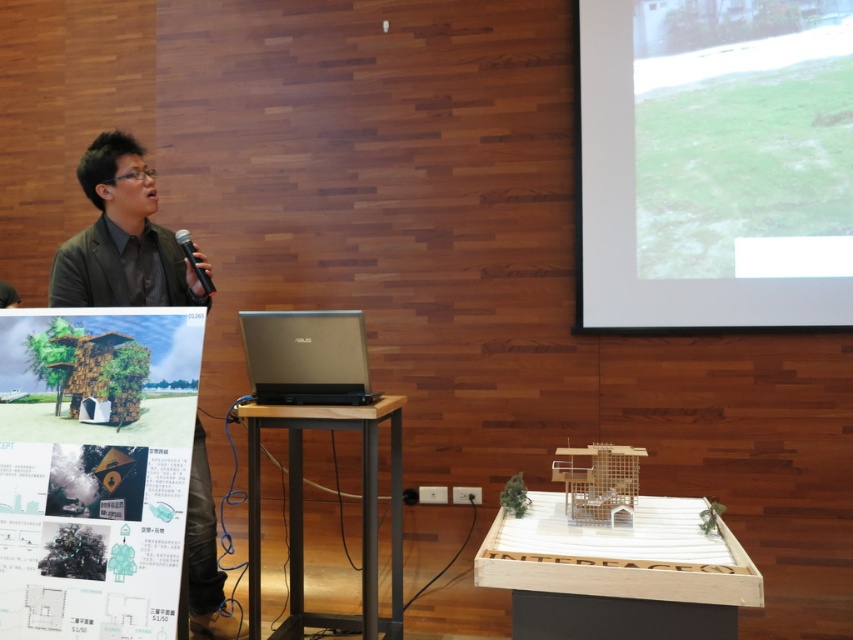
How far apart are dark gray suit at left and wooden podium at center?

dark gray suit at left and wooden podium at center are 3.33 feet apart.

Who is more distant from viewer, (103,289) or (370,577)?

Positioned behind is point (103,289).

At what (x,y) coordinates should I click in order to perform the action: click on dark gray suit at left. Please return your answer as a coordinate pair (x, y). The width and height of the screenshot is (853, 640). Looking at the image, I should click on (120, 237).

Does green grass at upper right have a greater height compared to wooden model house at center?

Yes.

Which is more to the right, green grass at upper right or wooden model house at center?

From the viewer's perspective, green grass at upper right appears more on the right side.

Locate an element on the screen. Image resolution: width=853 pixels, height=640 pixels. green grass at upper right is located at coordinates (714, 163).

Is wooden model house at center smaller than dark gray suit at left?

No.

Does point (581, 625) lie behind point (177, 291)?

No, it is not.

Who is more forward, (578, 582) or (193, 547)?

Point (578, 582) is in front.

I want to click on wooden model house at center, so click(x=618, y=573).